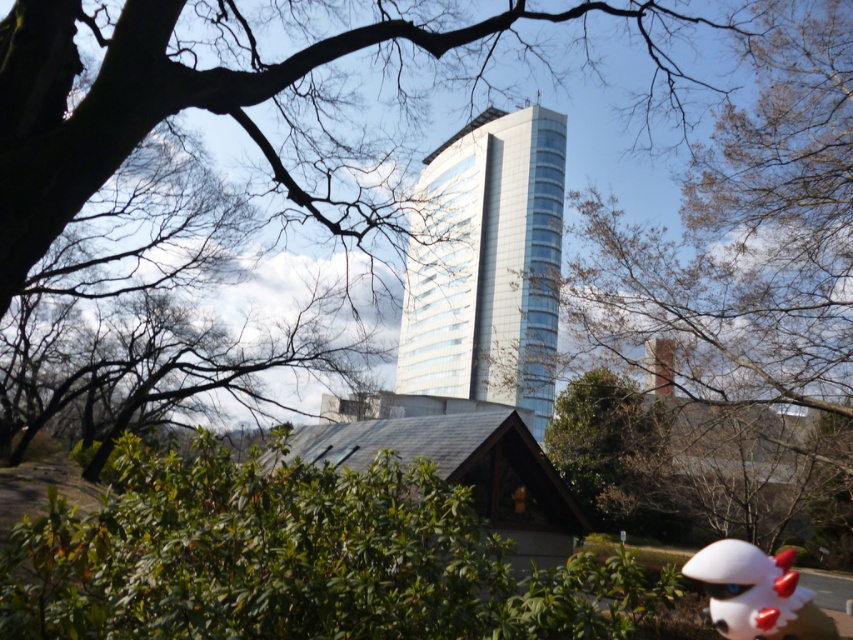
Can you confirm if green leafy tree at center is thinner than bare branches at upper center?

Incorrect, green leafy tree at center's width is not less than bare branches at upper center's.

Can you confirm if green leafy tree at center is positioned to the left of bare branches at upper center?

Indeed, green leafy tree at center is positioned on the left side of bare branches at upper center.

Which is in front, point (399, 184) or point (734, 432)?

Point (399, 184)

This screenshot has height=640, width=853. I want to click on green leafy tree at center, so click(277, 96).

Who is positioned more to the right, green leafy tree at center or transparent glass tower at center?

From the viewer's perspective, transparent glass tower at center appears more on the right side.

Between point (61, 92) and point (538, 268), which one is positioned in front?

Point (61, 92) is in front.

Locate an element on the screen. This screenshot has height=640, width=853. green leafy tree at center is located at coordinates (277, 96).

Between point (749, 298) and point (701, 572), which one is positioned behind?

Positioned behind is point (749, 298).

Can you confirm if bare branches at upper center is taller than white matte plush toy at lower right?

Yes, bare branches at upper center is taller than white matte plush toy at lower right.

You are a GUI agent. You are given a task and a screenshot of the screen. Output one action in this format:
    pyautogui.click(x=<x>, y=<y>)
    Task: Click on the bare branches at upper center
    
    Given the screenshot: What is the action you would take?
    pyautogui.click(x=747, y=275)

Locate an element on the screen. This screenshot has height=640, width=853. bare branches at upper center is located at coordinates [747, 275].